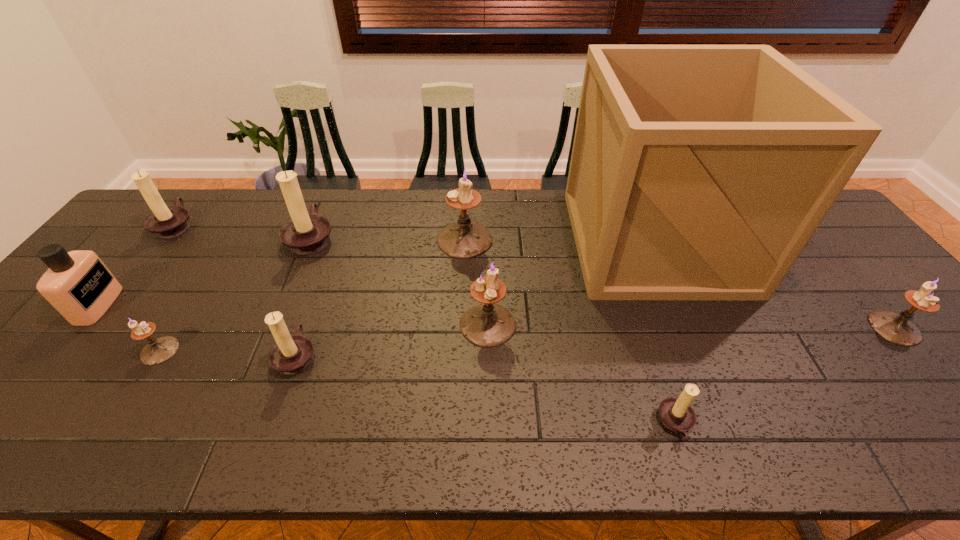
This screenshot has height=540, width=960. What are the coordinates of `free space located 0.280m on the front label of the perfume` in the screenshot? It's located at (219, 305).

You are a GUI agent. You are given a task and a screenshot of the screen. Output one action in this format:
    pyautogui.click(x=<x>, y=<y>)
    Task: Click on the vacant space situated on the wick of the second nearest brown candle holder
    Image resolution: width=960 pixels, height=540 pixels.
    Given the screenshot: What is the action you would take?
    pyautogui.click(x=469, y=355)

The height and width of the screenshot is (540, 960). Find the location of `vacant space located on the left of the second smallest purple candle holder`. vacant space located on the left of the second smallest purple candle holder is located at coordinates (844, 328).

You are a GUI agent. You are given a task and a screenshot of the screen. Output one action in this format:
    pyautogui.click(x=<x>, y=<y>)
    Task: Click on the free spot located on the right of the leftmost purple candle holder
    This screenshot has width=960, height=540.
    Given the screenshot: What is the action you would take?
    click(x=270, y=351)

This screenshot has height=540, width=960. I want to click on vacant space situated 0.370m on the wick of the second candle holder from right to left, so click(481, 423).

Image resolution: width=960 pixels, height=540 pixels. In order to click on free space located 0.050m on the wick of the second candle holder from right to left in this screenshot , I will do `click(634, 423)`.

Identify the location of vacant region located on the wick of the second candle holder from right to left. (558, 423).

You are a GUI agent. You are given a task and a screenshot of the screen. Output one action in this format:
    pyautogui.click(x=<x>, y=<y>)
    Task: Click on the box that is at the far edge
    This screenshot has width=960, height=540.
    Given the screenshot: What is the action you would take?
    pyautogui.click(x=698, y=172)

Locate an element on the screen. This screenshot has width=960, height=540. object present at the near edge is located at coordinates (x=676, y=414).

This screenshot has height=540, width=960. In order to click on candle holder that is at the left edge in this screenshot , I will do `click(166, 222)`.